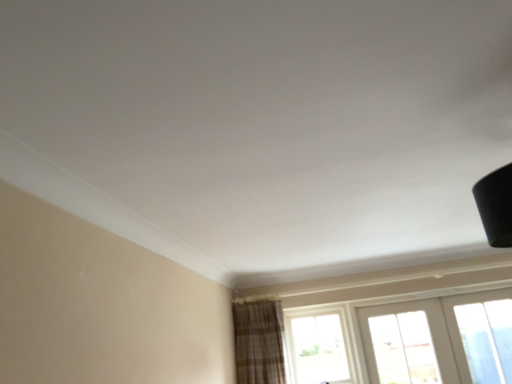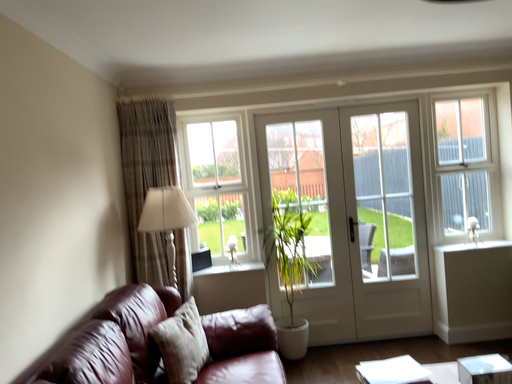
Question: Which way did the camera rotate in the video?

Choices:
 (A) rotated upward
 (B) rotated downward

Answer: (B)